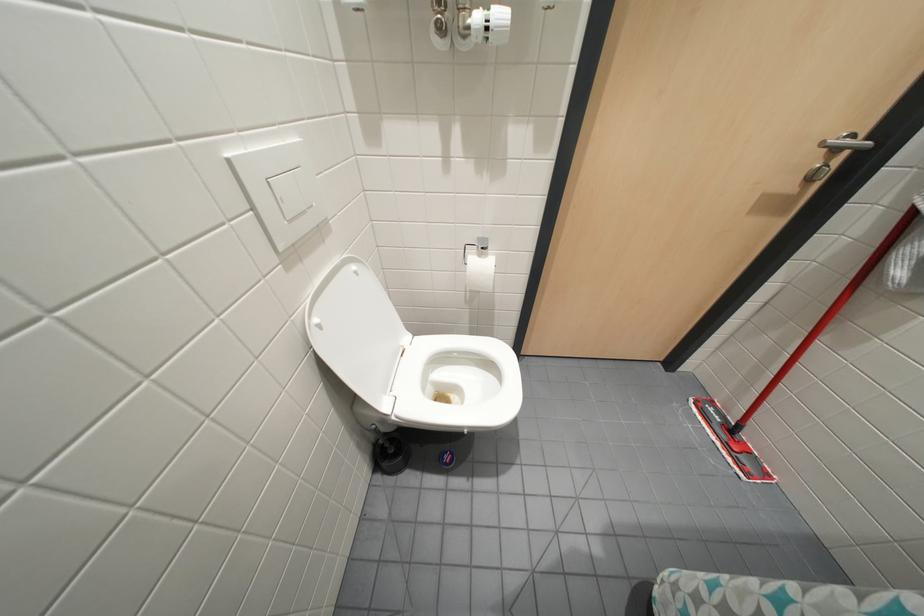
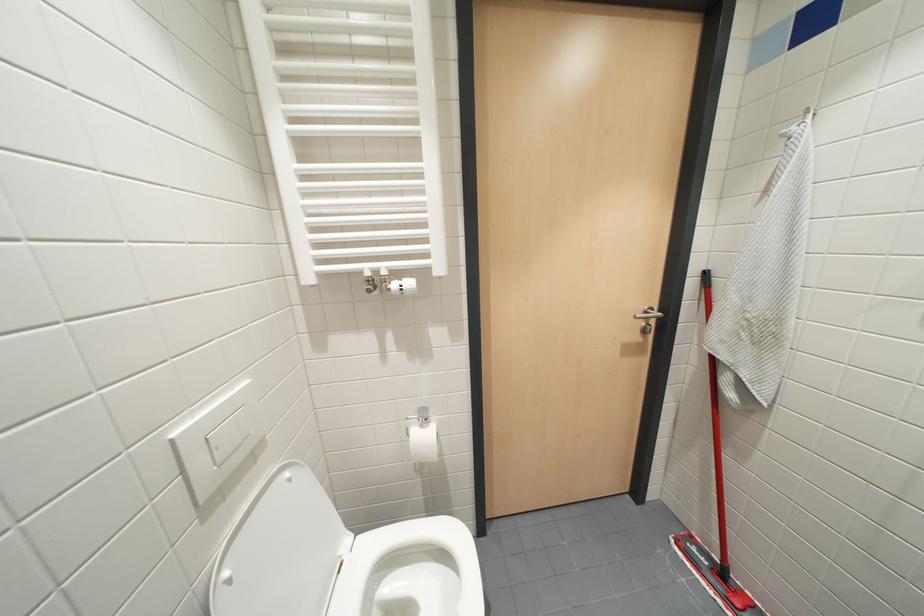
In a continuous first-person perspective shot, in which direction is the camera moving?

The movement direction of the cameraman is right, backward.